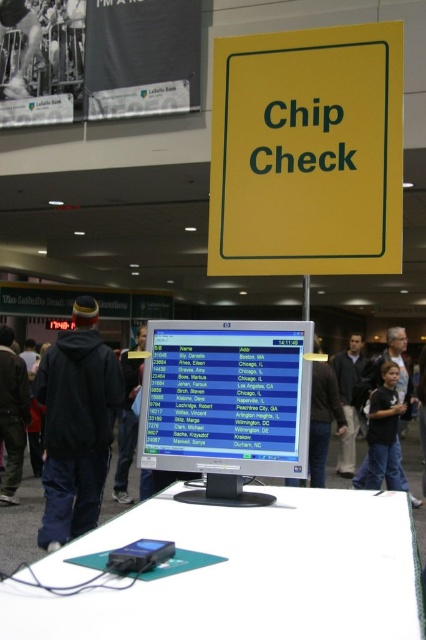
You are standing in the public space shown in the image and need to locate the black cotton shirt at center. Where would you look relative to the computer monitor displaying the list of names and addresses?

The black cotton shirt at center is located at the 2D coordinates point [399,372] relative to the computer monitor displaying the list of names and addresses.

You are a person standing in front of the monitor and see both the black fabric pants at lower left and the black cotton shirt at center. Which one is positioned more to the left side?

The black fabric pants at lower left are positioned more to the left side than the black cotton shirt at center.

You are standing in front of the monitor and see both the black cotton shirt at center and the dark blue hoodie at center. Which clothing item is shorter in height?

The black cotton shirt at center is shorter in height compared to the dark blue hoodie at center.